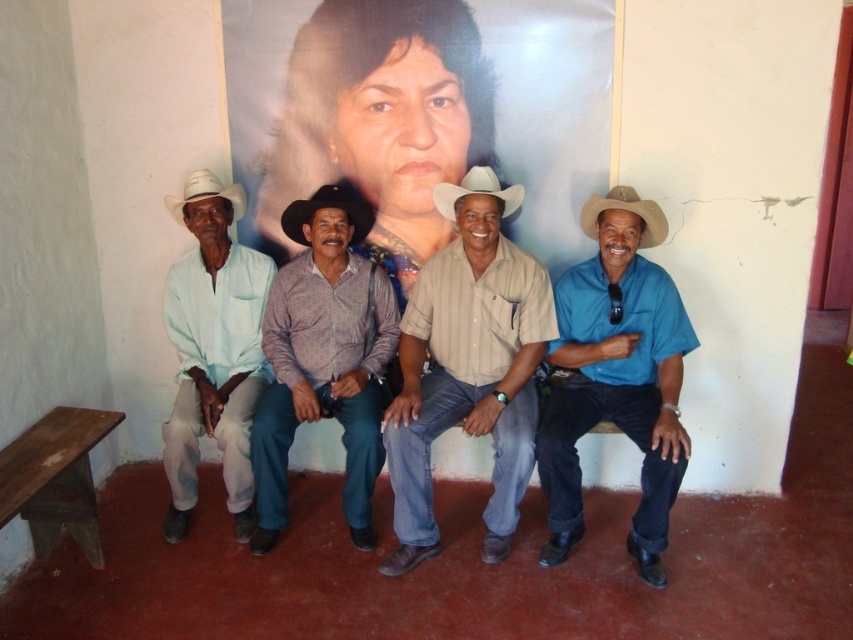
Question: Does brown wooden bench at lower left appear over brown felt cowboy hat at right?

Choices:
 (A) yes
 (B) no

Answer: (B)

Question: Does beige striped shirt at center appear under brown wooden bench at lower left?

Choices:
 (A) no
 (B) yes

Answer: (A)

Question: Which point is farther to the camera?

Choices:
 (A) (399, 321)
 (B) (210, 173)

Answer: (A)

Question: Is light blue cotton shirt at left positioned before black felt cowboy hat at center?

Choices:
 (A) no
 (B) yes

Answer: (B)

Question: Which object is farther from the camera taking this photo?

Choices:
 (A) beige striped shirt at center
 (B) white matte cowboy hat at center
 (C) light blue cotton shirt at left
 (D) white matte cowboy hat at left

Answer: (D)

Question: Estimate the real-world distances between objects in this image. Which object is farther from the black felt cowboy hat at center?

Choices:
 (A) blue cotton shirt at right
 (B) beige striped shirt at center
 (C) brown felt cowboy hat at right
 (D) purple cotton shirt at center

Answer: (A)